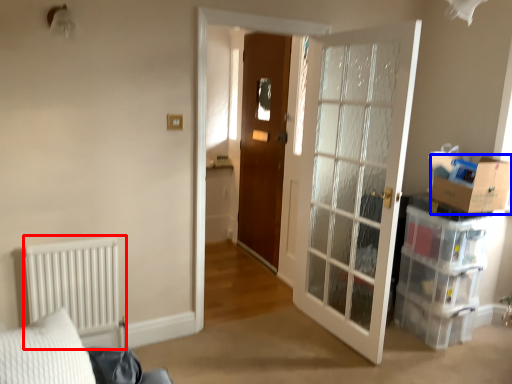
Question: Which of the following is the farthest to the observer, radiator (highlighted by a red box) or cardboard box (highlighted by a blue box)?

Choices:
 (A) radiator
 (B) cardboard box

Answer: (B)